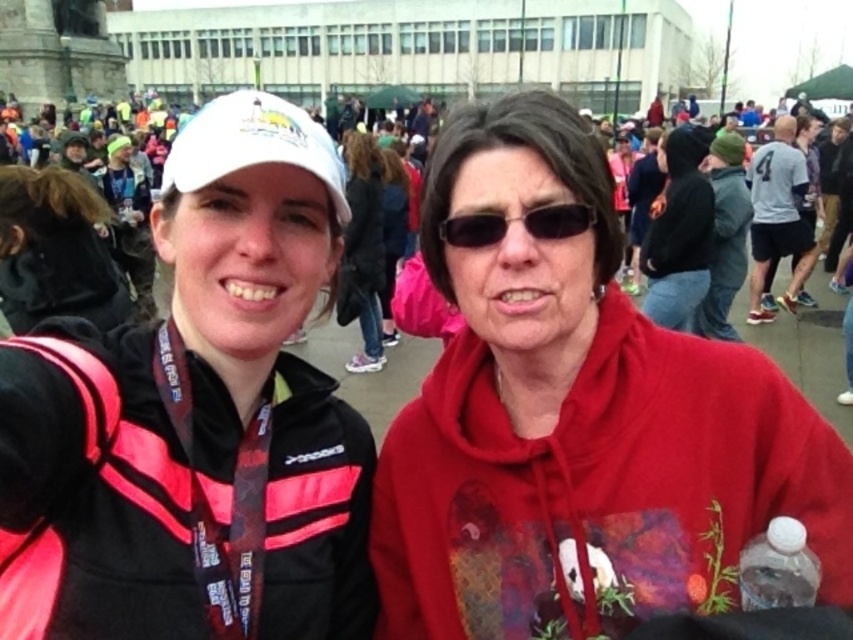
Question: Can you confirm if black matte jacket at left is positioned below black plastic sunglasses at center?

Choices:
 (A) no
 (B) yes

Answer: (B)

Question: Which is farther from the black plastic sunglasses at center?

Choices:
 (A) black matte jacket at left
 (B) matte red hoodie at center

Answer: (A)

Question: Among these points, which one is farthest from the camera?

Choices:
 (A) tap(444, 589)
 (B) tap(554, 232)
 (C) tap(73, 552)

Answer: (B)

Question: Which object appears closest to the camera in this image?

Choices:
 (A) black matte jacket at left
 (B) matte red hoodie at center

Answer: (A)

Question: Does dark brown hair at center have a lesser width compared to black plastic sunglasses at center?

Choices:
 (A) yes
 (B) no

Answer: (B)

Question: Is dark brown hair at center bigger than black plastic sunglasses at center?

Choices:
 (A) yes
 (B) no

Answer: (A)